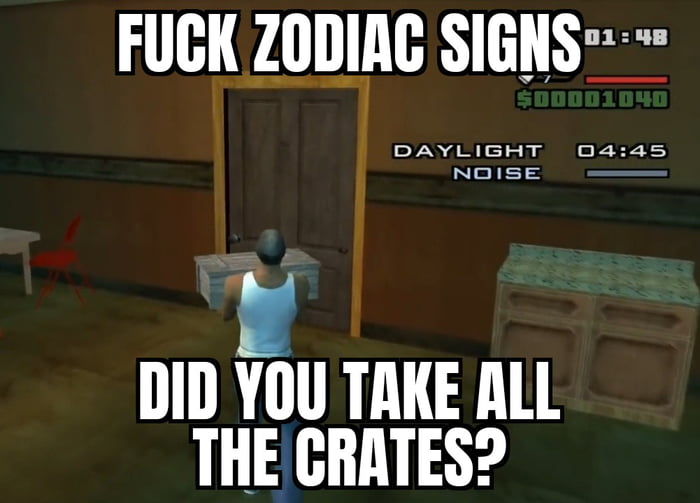
I want to click on door jam, so click(217, 95).